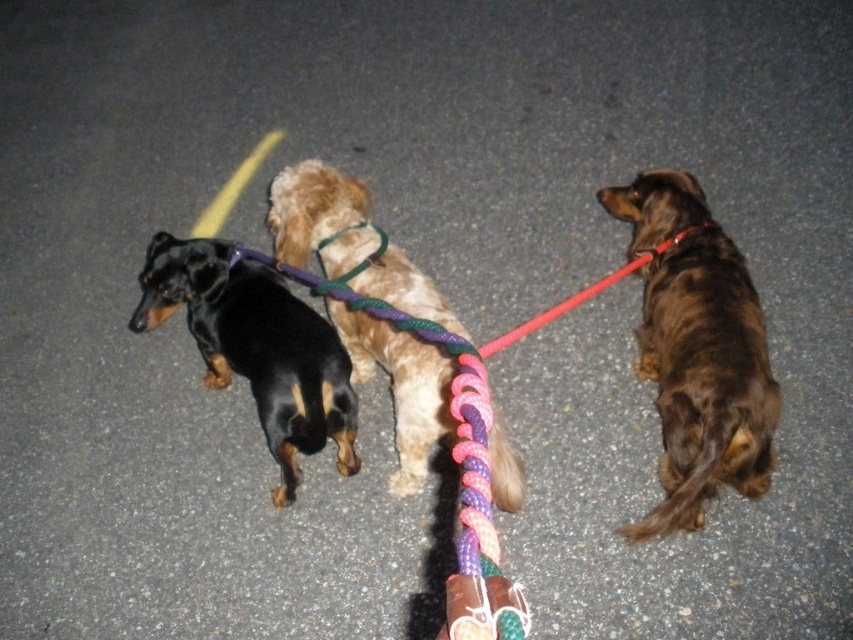
You are a night security guard and see the black smooth dog at left and the fuzzy brown dog at center. Which dog is positioned closer to the left side of the path?

The black smooth dog at left is positioned closer to the left side of the path than the fuzzy brown dog at center.

You are a dog owner who wants to take a photo of the brown furry dog at right and the fuzzy brown dog at center. Since it is dark, you need to know which dog is closer to you to focus your camera. Which dog should you focus on first?

The brown furry dog at right is closer to the viewer than the fuzzy brown dog at center, so focus on the brown furry dog at right first.

You are a dog walker holding two leashes attached to the black smooth dog at left and the fuzzy brown dog at center. The leashes are both 1.5 meters long. If you want to ensure both dogs can walk side by side without their leashes getting tangled, which dog should you position closer to the yellow line on the pavement?

The black smooth dog at left is bigger than the fuzzy brown dog at center, so you should position the larger black smooth dog at left closer to the yellow line. This way, the smaller fuzzy brown dog at center can stay on the side away from the line, reducing the chance of their leashes crossing or tangling as they walk.